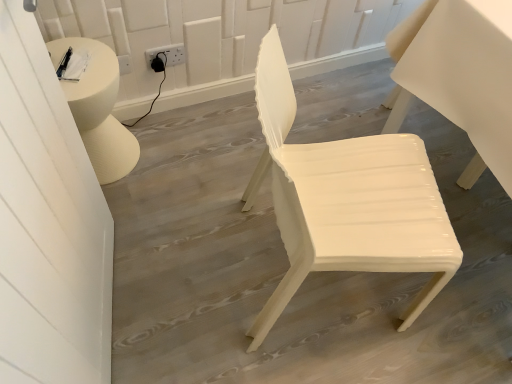
The height and width of the screenshot is (384, 512). Describe the element at coordinates (167, 54) in the screenshot. I see `white plastic outlet at upper center` at that location.

The width and height of the screenshot is (512, 384). I want to click on white plastic outlet at upper center, so click(167, 54).

From the picture: Measure the distance between point (148, 53) and camera.

A distance of 5.28 feet exists between point (148, 53) and camera.

Identify the location of glossy white chair at center. (346, 200).

What do you see at coordinates (346, 200) in the screenshot?
I see `glossy white chair at center` at bounding box center [346, 200].

Measure the distance between point (271, 148) and camera.

The depth of point (271, 148) is 32.99 inches.

Measure the distance between glossy white chair at center and camera.

A distance of 72.66 centimeters exists between glossy white chair at center and camera.

The width and height of the screenshot is (512, 384). Find the location of `white plastic outlet at upper center`. white plastic outlet at upper center is located at coordinates (167, 54).

Based on the photo, which object is positioned more to the left, white plastic outlet at upper center or glossy white chair at center?

From the viewer's perspective, white plastic outlet at upper center appears more on the left side.

Is white plastic outlet at upper center positioned before glossy white chair at center?

No.

Is point (184, 59) more distant than point (420, 238)?

Yes, it is.

From the image's perspective, would you say white plastic outlet at upper center is shown under glossy white chair at center?

Incorrect, from the image's perspective, white plastic outlet at upper center is higher than glossy white chair at center.

From a real-world perspective, is white plastic outlet at upper center beneath glossy white chair at center?

Yes.

Which of these two, white plastic outlet at upper center or glossy white chair at center, is thinner?

With smaller width is white plastic outlet at upper center.

Considering the relative sizes of white plastic outlet at upper center and glossy white chair at center in the image provided, is white plastic outlet at upper center taller than glossy white chair at center?

In fact, white plastic outlet at upper center may be shorter than glossy white chair at center.

Does white plastic outlet at upper center have a smaller size compared to glossy white chair at center?

Yes.

Could glossy white chair at center be considered to be inside white plastic outlet at upper center?

No, white plastic outlet at upper center does not contain glossy white chair at center.

Does white plastic outlet at upper center touch glossy white chair at center?

No, white plastic outlet at upper center is not beside glossy white chair at center.

Is white plastic outlet at upper center aimed at glossy white chair at center?

Yes, white plastic outlet at upper center is oriented towards glossy white chair at center.

Find the location of a particular element. electric outlet behind the glossy white chair at center is located at coordinates (167, 54).

Which object is positioned more to the left, glossy white chair at center or white plastic outlet at upper center?

white plastic outlet at upper center.

Is the position of glossy white chair at center less distant than that of white plastic outlet at upper center?

Yes, glossy white chair at center is closer to the camera.

Between point (405, 199) and point (184, 61), which one is positioned behind?

The point (184, 61) is farther.

From the image's perspective, does glossy white chair at center appear lower than white plastic outlet at upper center?

Yes.

From a real-world perspective, which object rests below the other?

white plastic outlet at upper center.

Which object is thinner, glossy white chair at center or white plastic outlet at upper center?

white plastic outlet at upper center.

Which of these two, glossy white chair at center or white plastic outlet at upper center, stands taller?

glossy white chair at center.

Can you confirm if glossy white chair at center is bigger than white plastic outlet at upper center?

Correct, glossy white chair at center is larger in size than white plastic outlet at upper center.

Is glossy white chair at center situated inside white plastic outlet at upper center or outside?

glossy white chair at center exists outside the volume of white plastic outlet at upper center.

Is glossy white chair at center not near white plastic outlet at upper center?

No, glossy white chair at center is not far from white plastic outlet at upper center.

Could you tell me if glossy white chair at center is facing white plastic outlet at upper center?

No, glossy white chair at center is not aimed at white plastic outlet at upper center.

Identify the location of chair below the white plastic outlet at upper center (from the image's perspective). The width and height of the screenshot is (512, 384). pyautogui.click(x=346, y=200).

Identify the location of chair on the right of white plastic outlet at upper center. (346, 200).

Where is `chair above the white plastic outlet at upper center (from a real-world perspective)`? This screenshot has width=512, height=384. chair above the white plastic outlet at upper center (from a real-world perspective) is located at coordinates (346, 200).